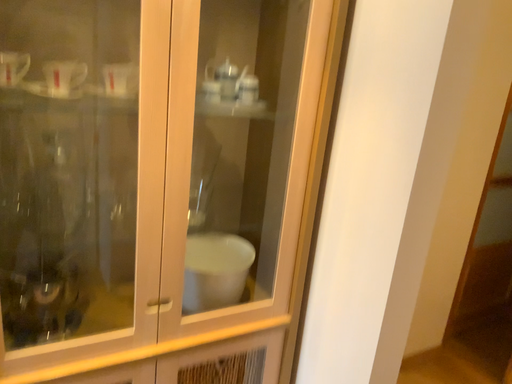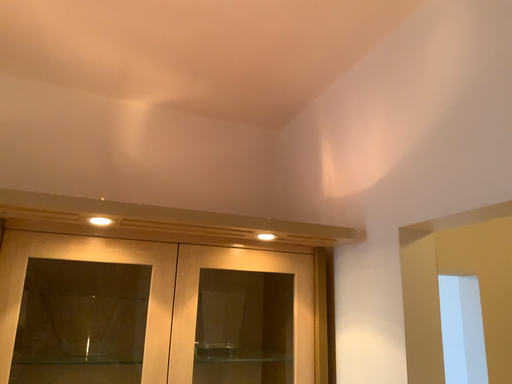
Question: Which way did the camera rotate in the video?

Choices:
 (A) rotated left
 (B) rotated right

Answer: (A)